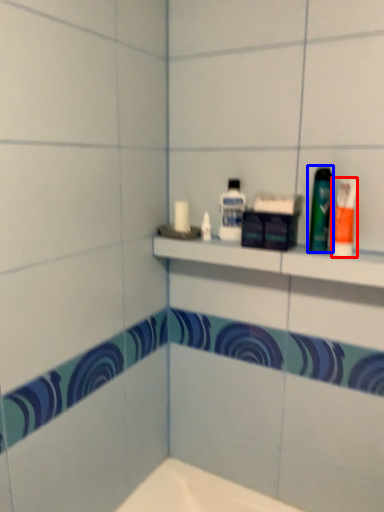
Question: Which point is further to the camera, toiletry (highlighted by a red box) or mouthwash (highlighted by a blue box)?

Choices:
 (A) toiletry
 (B) mouthwash

Answer: (B)